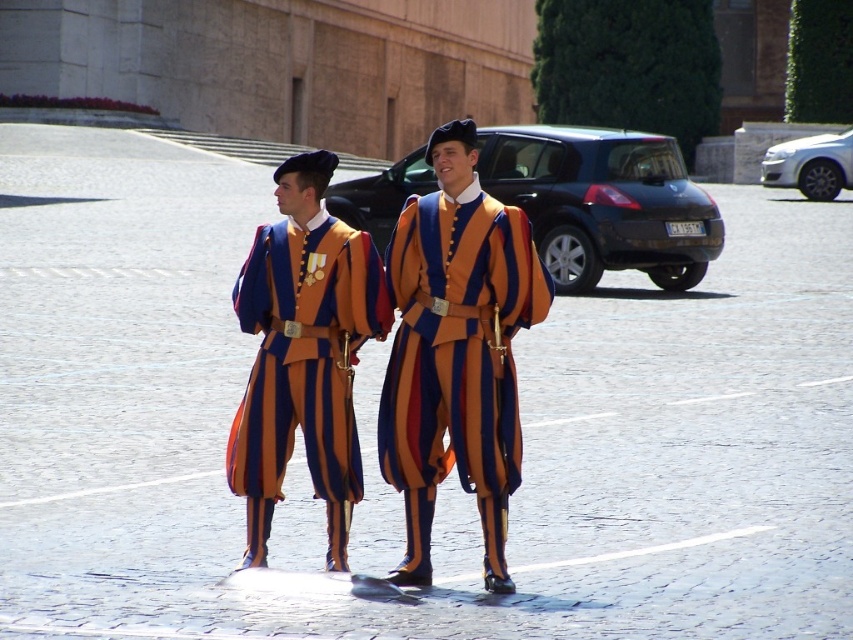
You are a photographer planning to take a group photo of the two individuals wearing the orange and blue striped uniform at center and the matte striped uniform at center. You want to ensure that both are visible in the frame. Given their height difference, which individual should you position closer to the camera to avoid one being obscured by the other?

The orange and blue striped uniform at center is taller than the matte striped uniform at center, so you should position the matte striped uniform at center closer to the camera to prevent the taller individual from obscuring the shorter one.

You are a photographer trying to capture both individuals in a single frame. Since the orange and blue striped uniform at center and the matte striped uniform at center are positioned differently, which one will appear larger in the photo?

The orange and blue striped uniform at center will appear larger in the photo because it is closer to the viewer than the matte striped uniform at center.

You are a photographer taking a picture of the two uniforms. You notice the orange and blue striped uniform at center and the matte striped uniform at center. Which uniform is covering part of the other?

The orange and blue striped uniform at center is positioned over matte striped uniform at center, so it is covering part of the matte striped uniform at center.